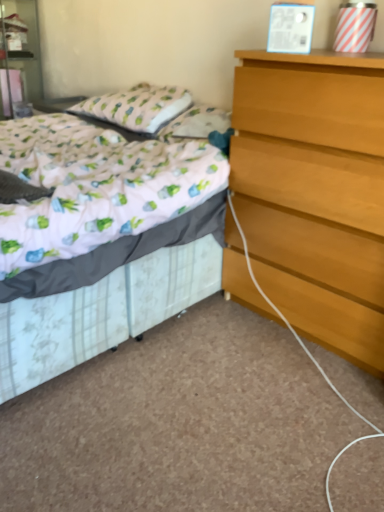
Question: Is white floral fabric bed at center far from matte white nightstand at upper left?

Choices:
 (A) no
 (B) yes

Answer: (B)

Question: Is white floral fabric bed at center positioned in front of matte white nightstand at upper left?

Choices:
 (A) yes
 (B) no

Answer: (A)

Question: Does white floral fabric bed at center have a larger size compared to matte white nightstand at upper left?

Choices:
 (A) yes
 (B) no

Answer: (A)

Question: Is white floral fabric bed at center positioned behind matte white nightstand at upper left?

Choices:
 (A) yes
 (B) no

Answer: (B)

Question: From a real-world perspective, is white floral fabric bed at center below matte white nightstand at upper left?

Choices:
 (A) no
 (B) yes

Answer: (B)

Question: Considering their positions, is white floral fabric bed at center located in front of or behind matte white nightstand at upper left?

Choices:
 (A) front
 (B) behind

Answer: (A)

Question: In terms of width, does white floral fabric bed at center look wider or thinner when compared to matte white nightstand at upper left?

Choices:
 (A) wide
 (B) thin

Answer: (A)

Question: From a real-world perspective, is white floral fabric bed at center physically located above or below matte white nightstand at upper left?

Choices:
 (A) below
 (B) above

Answer: (A)

Question: Is white floral fabric bed at center to the left or to the right of matte white nightstand at upper left in the image?

Choices:
 (A) right
 (B) left

Answer: (A)

Question: In the image, is patterned fabric pillow at upper left positioned in front of or behind light brown wooden chest of drawers at right?

Choices:
 (A) front
 (B) behind

Answer: (B)

Question: Considering the positions of patterned fabric pillow at upper left and light brown wooden chest of drawers at right in the image, is patterned fabric pillow at upper left bigger or smaller than light brown wooden chest of drawers at right?

Choices:
 (A) small
 (B) big

Answer: (A)

Question: Does point (175, 87) appear closer or farther from the camera than point (344, 155)?

Choices:
 (A) closer
 (B) farther

Answer: (B)

Question: In terms of width, does patterned fabric pillow at upper left look wider or thinner when compared to light brown wooden chest of drawers at right?

Choices:
 (A) thin
 (B) wide

Answer: (A)

Question: Is point (380, 245) closer or farther from the camera than point (31, 88)?

Choices:
 (A) closer
 (B) farther

Answer: (A)

Question: From the image's perspective, is light brown wooden chest of drawers at right located above or below matte white nightstand at upper left?

Choices:
 (A) above
 (B) below

Answer: (B)